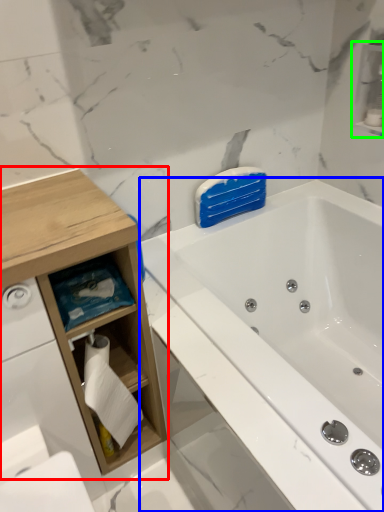
Question: Based on their relative distances, which object is farther from cabinetry (highlighted by a red box)? Choose from bathtub (highlighted by a blue box) and cabinet (highlighted by a green box).

Choices:
 (A) bathtub
 (B) cabinet

Answer: (B)